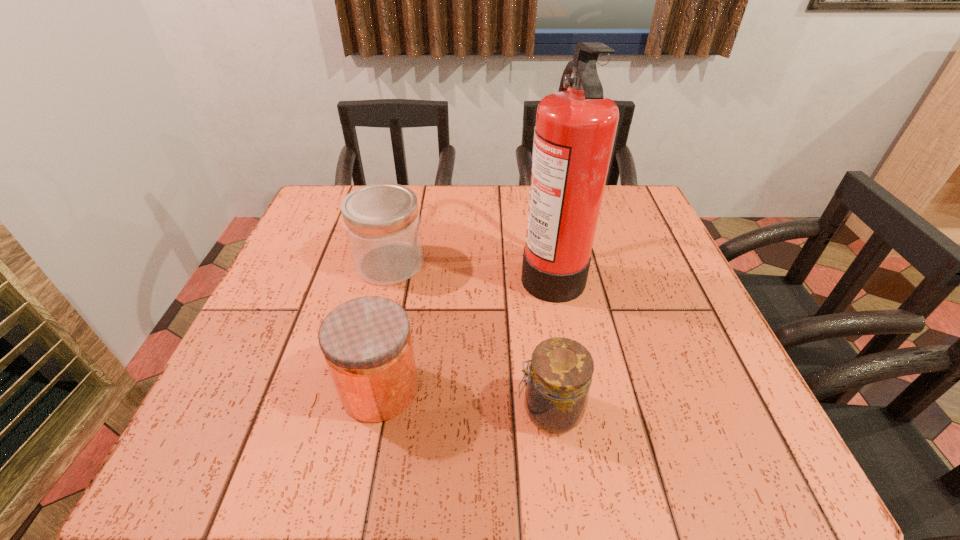
The height and width of the screenshot is (540, 960). What are the coordinates of `the tallest object` in the screenshot? It's located at (575, 130).

Find the location of a particular element. The width and height of the screenshot is (960, 540). the farthest jar is located at coordinates (382, 223).

Where is `the shortest jar`? This screenshot has width=960, height=540. the shortest jar is located at coordinates (559, 377).

What are the coordinates of `the rightmost jar` in the screenshot? It's located at (559, 377).

This screenshot has width=960, height=540. I want to click on free spot located 0.190m on the front-facing side of the fire extinguisher, so click(x=438, y=270).

Locate an element on the screen. The height and width of the screenshot is (540, 960). vacant space located 0.050m on the front-facing side of the fire extinguisher is located at coordinates (498, 270).

This screenshot has width=960, height=540. What are the coordinates of `vacant space located on the front-facing side of the fire extinguisher` in the screenshot? It's located at (442, 270).

Identify the location of vacant space positioned on the right of the farthest jar. The height and width of the screenshot is (540, 960). (484, 264).

At what (x,y) coordinates should I click in order to perform the action: click on vacant space situated on the lid of the rightmost jar. Please return your answer as a coordinate pair (x, y). Looking at the image, I should click on (298, 410).

This screenshot has height=540, width=960. What are the coordinates of `blank space located 0.330m on the lid of the rightmost jar` in the screenshot? It's located at (321, 410).